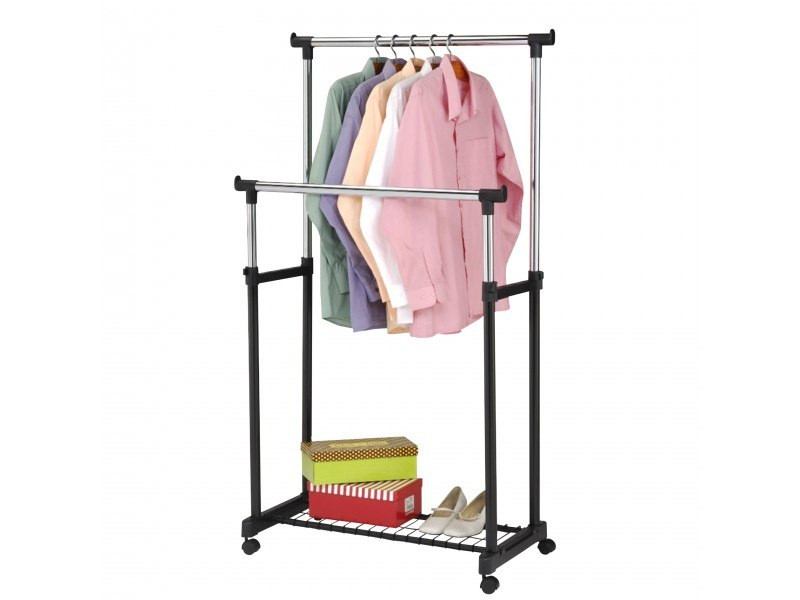
Identify the location of clothes hangers. (377, 45), (392, 43), (410, 46), (432, 43), (448, 46).